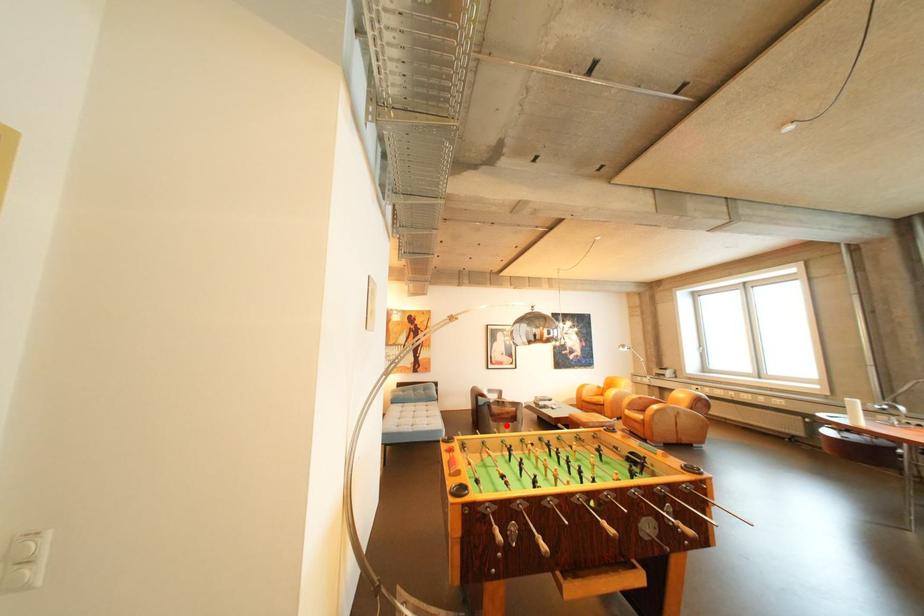
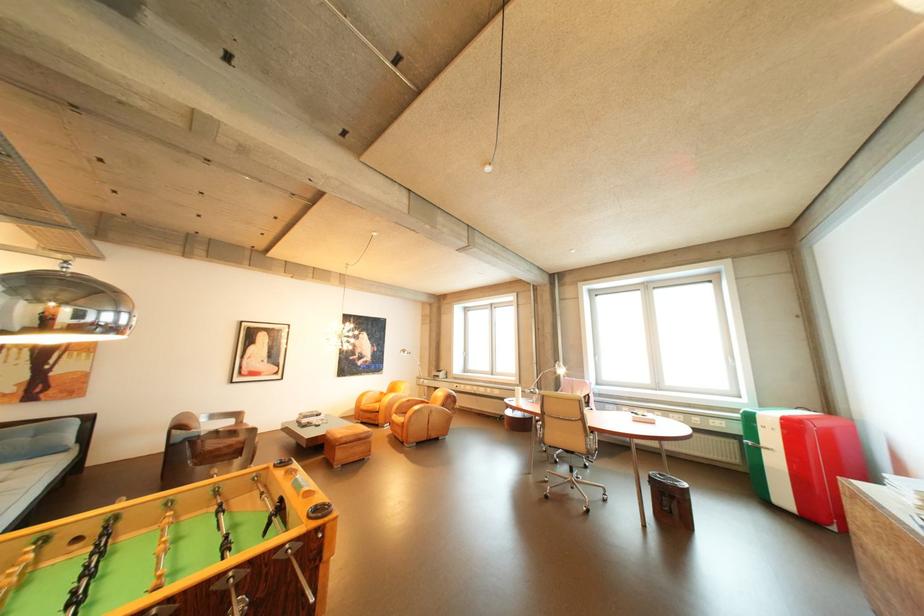
Where in the second image is the point corresponding to the highlighted location from the first image?

(213, 469)